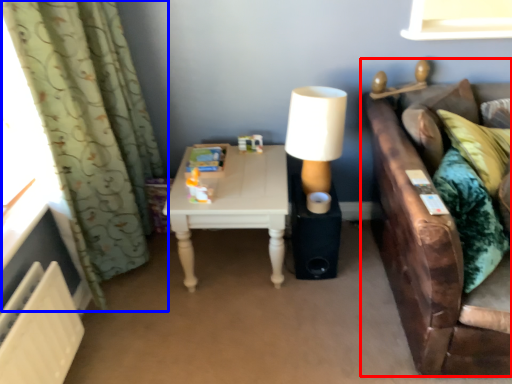
Question: Which object is further to the camera taking this photo, studio couch (highlighted by a red box) or curtain (highlighted by a blue box)?

Choices:
 (A) studio couch
 (B) curtain

Answer: (B)